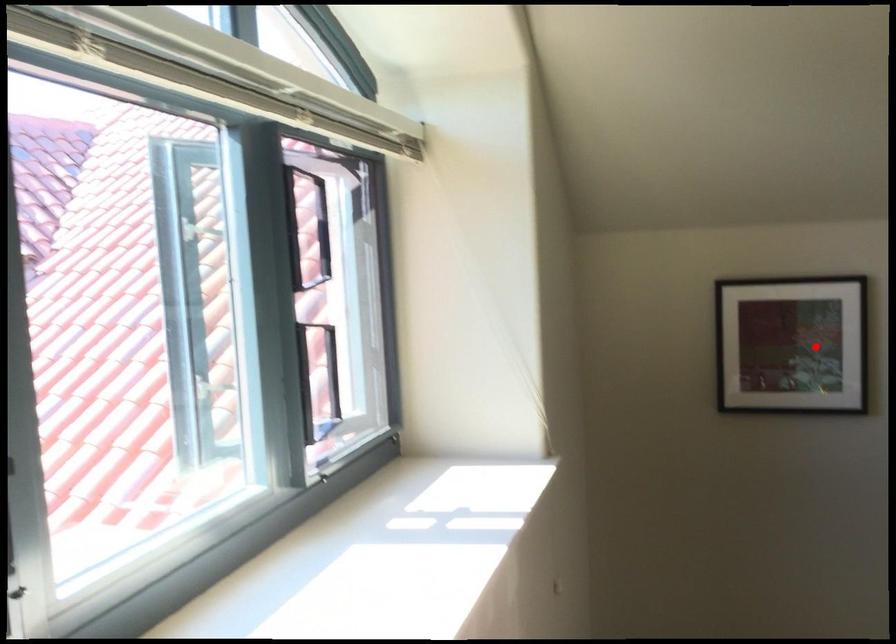
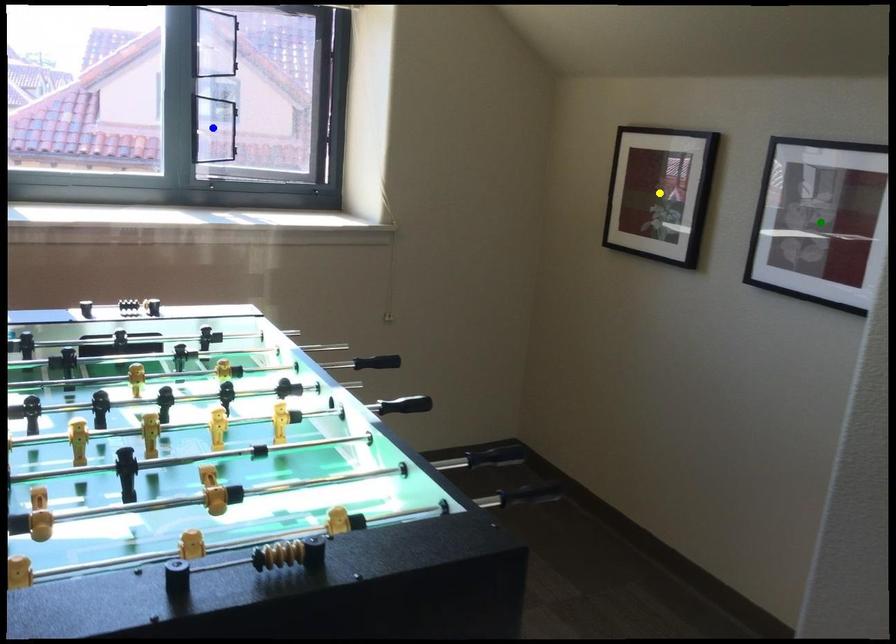
Question: I am providing you with two images of the same scene from different viewpoints. A red point is marked on the first image. You are given multiple points on the second image. Which mark in image 2 goes with the point in image 1?

Choices:
 (A) green point
 (B) yellow point
 (C) blue point

Answer: (B)